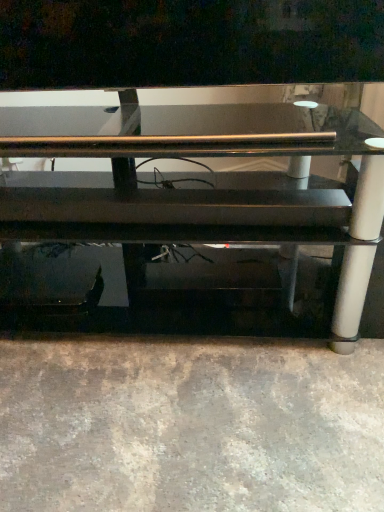
This screenshot has width=384, height=512. Describe the element at coordinates (205, 203) in the screenshot. I see `black glass table at center` at that location.

Locate an element on the screen. black glass table at center is located at coordinates (205, 203).

Locate an element on the screen. black glass table at center is located at coordinates (205, 203).